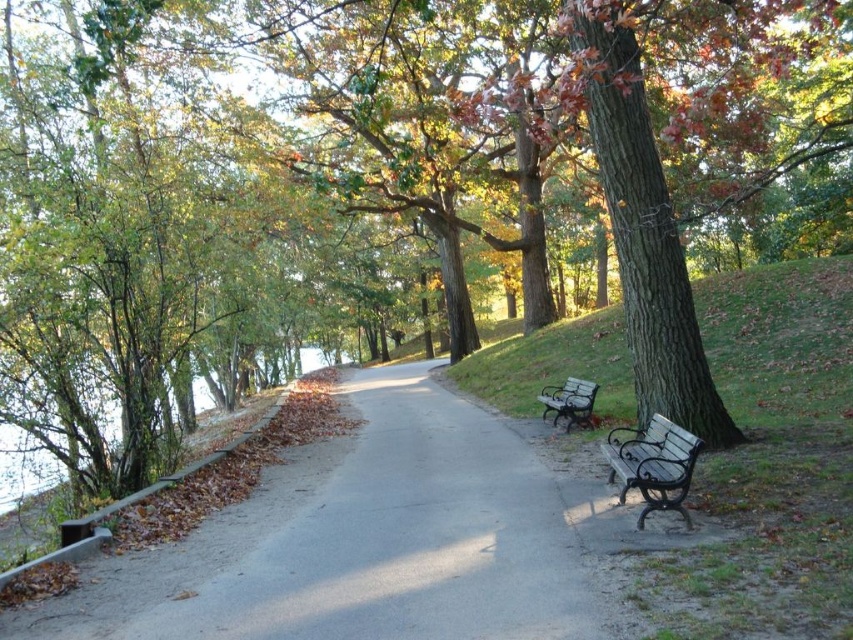
What do you see at coordinates (358, 541) in the screenshot? I see `gray asphalt path at center` at bounding box center [358, 541].

Looking at this image, measure the distance between gray asphalt path at center and brown rough bark tree at center-right.

gray asphalt path at center is 13.18 feet away from brown rough bark tree at center-right.

The image size is (853, 640). I want to click on gray asphalt path at center, so click(x=358, y=541).

Locate an element on the screen. Image resolution: width=853 pixels, height=640 pixels. gray asphalt path at center is located at coordinates (358, 541).

Who is more forward, (613, 432) or (50, 484)?

Point (50, 484)

Does wooden park bench at lower right have a lesser height compared to green leafy water at left?

Correct, wooden park bench at lower right is not as tall as green leafy water at left.

Does point (672, 451) come behind point (196, 384)?

No, (672, 451) is closer to viewer.

Locate an element on the screen. This screenshot has height=640, width=853. wooden park bench at lower right is located at coordinates (653, 465).

Describe the element at coordinates (643, 228) in the screenshot. I see `brown rough bark tree at center-right` at that location.

Which is above, brown rough bark tree at center-right or metallic brown bench at center?

brown rough bark tree at center-right is higher up.

Does point (608, 90) lie in front of point (558, 387)?

Yes.

You are a GUI agent. You are given a task and a screenshot of the screen. Output one action in this format:
    pyautogui.click(x=<x>, y=<y>)
    Task: Click on the brown rough bark tree at center-right
    This screenshot has width=853, height=640.
    Given the screenshot: What is the action you would take?
    pyautogui.click(x=643, y=228)